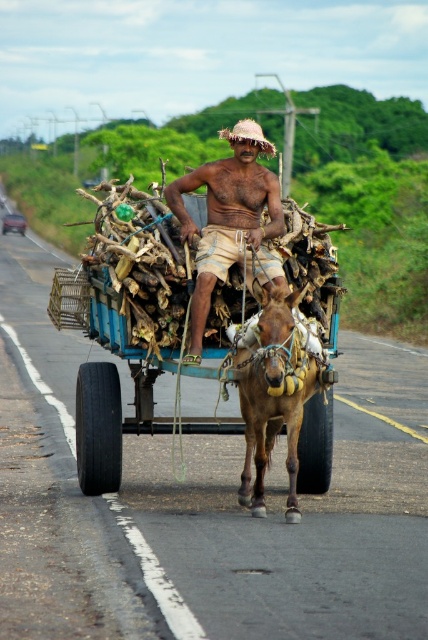
You are a traveler who needs to cross a narrow bridge that can only hold one object at a time. You see the blue painted wood horse cart at center and the brown leather donkey at center. Which one should you let pass first to ensure safety?

The blue painted wood horse cart at center is bigger than the brown leather donkey at center, so you should let the brown leather donkey at center pass first since it is smaller and safer to cross the narrow bridge.

You are a traveler observing the man and the donkey in the scene. Which object is larger in size between the brown textured shorts at center and the brown leather donkey at center?

The brown textured shorts at center is bigger than the brown leather donkey at center according to the description.

You are a photographer trying to capture the scene of the man and the donkey. You need to ensure that both the brown textured shorts at center and the brown leather donkey at center are clearly visible in the photo. Based on their heights, which one might require you to adjust your camera angle more to include fully in the frame?

The brown textured shorts at center has a greater height compared to the brown leather donkey at center, so you might need to adjust your camera angle more to include the brown textured shorts at center fully in the frame.